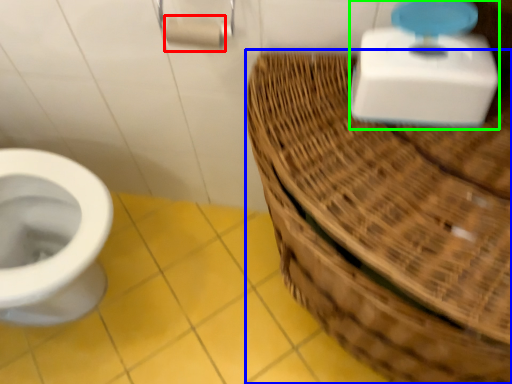
Question: Which is farther away from toilet paper (highlighted by a red box)? basket (highlighted by a blue box) or scale (highlighted by a green box)?

Choices:
 (A) basket
 (B) scale

Answer: (A)